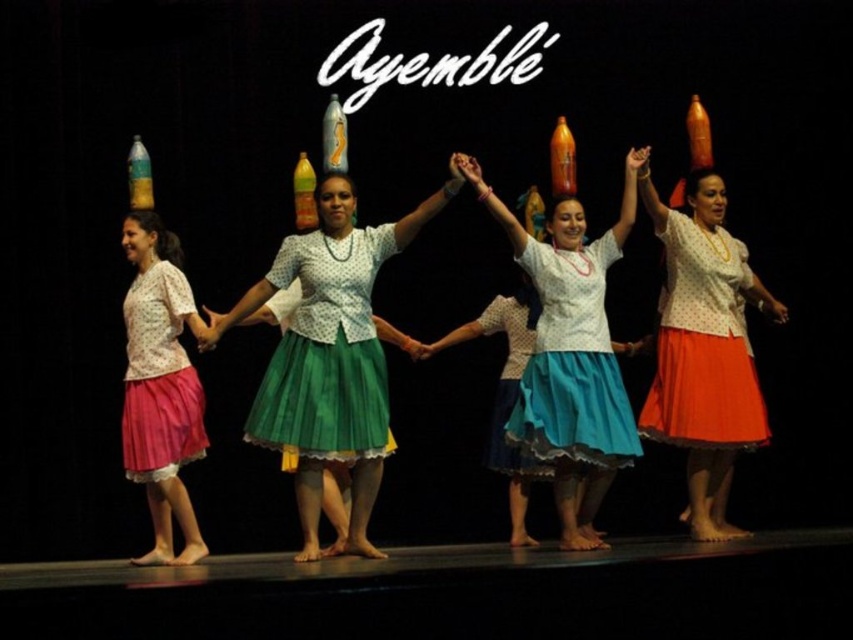
Question: Based on their relative distances, which object is farther from the blue tulle skirt at center?

Choices:
 (A) polka dot fabric blouse at center
 (B) green satin skirt at center
 (C) pink chiffon skirt at left
 (D) matte white blouse at center

Answer: (C)

Question: Does matte white blouse at center have a larger size compared to blue tulle skirt at center?

Choices:
 (A) no
 (B) yes

Answer: (A)

Question: Considering the real-world distances, which object is farthest from the blue tulle skirt at center?

Choices:
 (A) polka dot fabric blouse at center
 (B) matte orange skirt at center
 (C) pink chiffon skirt at left
 (D) green satin skirt at center

Answer: (C)

Question: Which point is farther from the camera taking this photo?

Choices:
 (A) (511, 369)
 (B) (636, 436)
 (C) (343, 419)
 (D) (698, 387)

Answer: (A)

Question: Considering the relative positions of polka dot fabric blouse at center and matte orange skirt at center in the image provided, where is polka dot fabric blouse at center located with respect to matte orange skirt at center?

Choices:
 (A) above
 (B) below

Answer: (B)

Question: Where is matte white blouse at center located in relation to pink chiffon skirt at left in the image?

Choices:
 (A) right
 (B) left

Answer: (A)